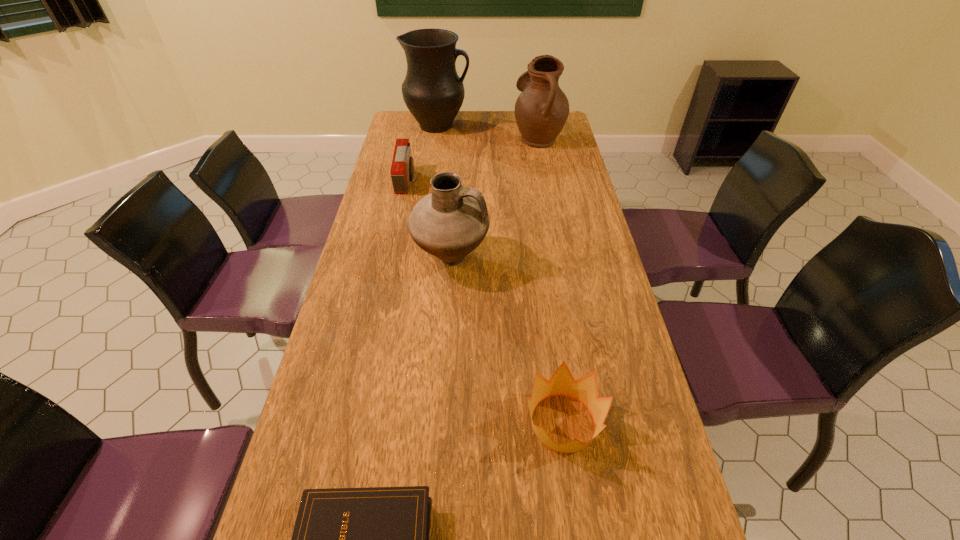
This screenshot has height=540, width=960. What are the coordinates of `free region that satisfies the following two spatial constraints: 1. on the handle side of the shortest pitcher; 2. on the right side of the second nearest object` in the screenshot? It's located at (440, 423).

I want to click on vacant region that satisfies the following two spatial constraints: 1. on the front-facing side of the camera; 2. on the right side of the fifth farthest object, so click(355, 423).